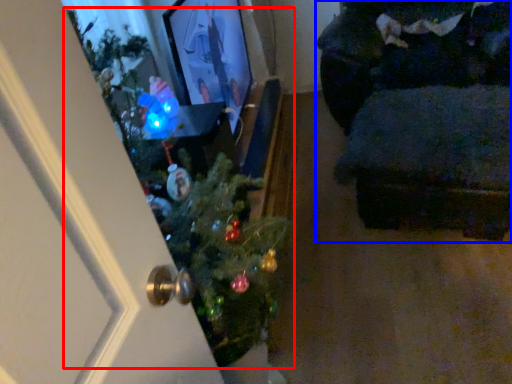
Question: Among these objects, which one is nearest to the camera, christmas tree (highlighted by a red box) or furniture (highlighted by a blue box)?

Choices:
 (A) christmas tree
 (B) furniture

Answer: (A)